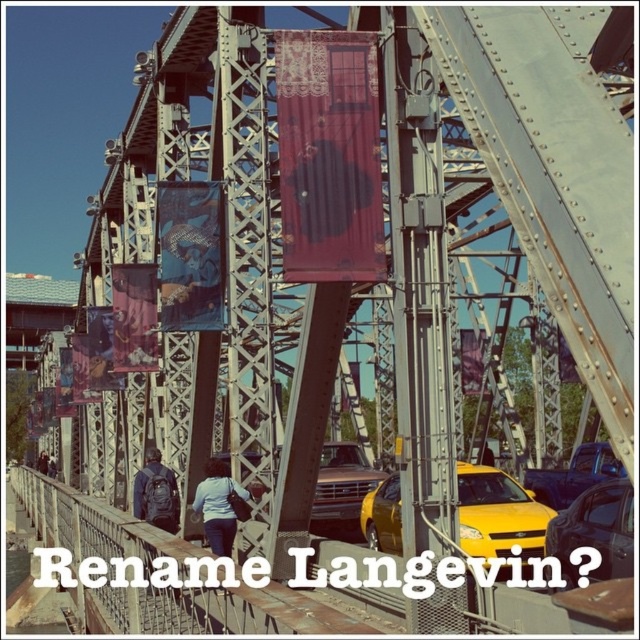
Can you confirm if blue denim jeans at center is wider than matte black backpack at lower left?

No, blue denim jeans at center is not wider than matte black backpack at lower left.

Can you confirm if blue denim jeans at center is bigger than matte black backpack at lower left?

Actually, blue denim jeans at center might be smaller than matte black backpack at lower left.

What do you see at coordinates (220, 506) in the screenshot? I see `blue denim jeans at center` at bounding box center [220, 506].

Identify the location of blue denim jeans at center. The image size is (640, 640). (220, 506).

Between yellow matte taxi at center and matte black backpack at lower left, which one appears on the left side from the viewer's perspective?

Positioned to the left is matte black backpack at lower left.

Can you confirm if yellow matte taxi at center is smaller than matte black backpack at lower left?

Actually, yellow matte taxi at center might be larger than matte black backpack at lower left.

Is point (500, 477) farther from camera compared to point (38, 458)?

No, it is in front of (38, 458).

At what (x,y) coordinates should I click in order to perform the action: click on yellow matte taxi at center. Please return your answer as a coordinate pair (x, y). This screenshot has width=640, height=640. Looking at the image, I should click on (499, 515).

Does dark gray backpack at center have a larger size compared to brown leather backpack at center?

Yes.

Does dark gray backpack at center have a greater width compared to brown leather backpack at center?

Correct, the width of dark gray backpack at center exceeds that of brown leather backpack at center.

Between point (148, 472) and point (353, 452), which one is positioned in front?

Positioned in front is point (148, 472).

Locate an element on the screen. The height and width of the screenshot is (640, 640). dark gray backpack at center is located at coordinates (156, 493).